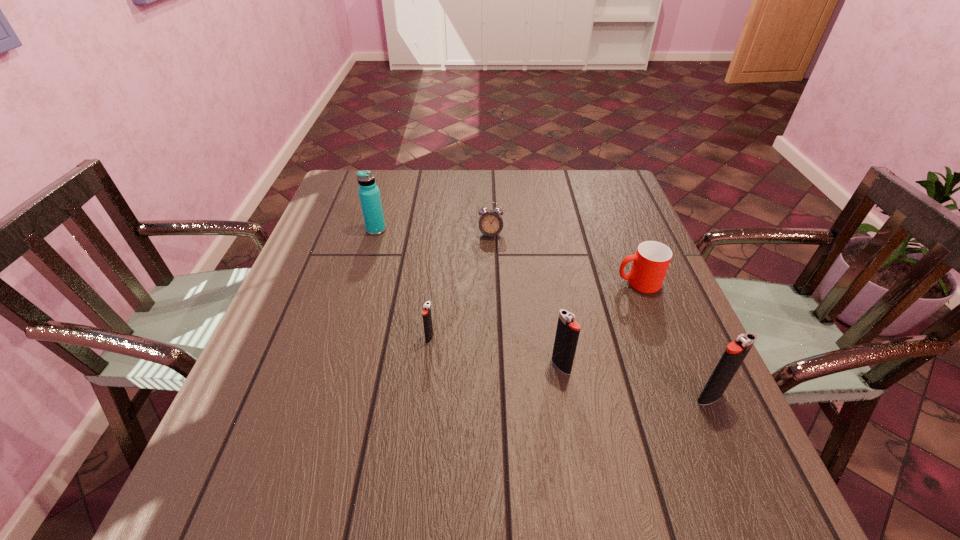
Find the location of a particular element. The image size is (960, 540). the fifth object from right to left is located at coordinates (426, 312).

Where is `the farthest igniter`? the farthest igniter is located at coordinates (426, 312).

Find the location of a particular element. The image size is (960, 540). the third object from right to left is located at coordinates 567,333.

At what (x,y) coordinates should I click in order to perform the action: click on the second shortest igniter. Please return your answer as a coordinate pair (x, y). Image resolution: width=960 pixels, height=540 pixels. Looking at the image, I should click on (567, 333).

This screenshot has height=540, width=960. I want to click on the nearest igniter, so click(x=736, y=351).

In order to click on the nearest object in this screenshot , I will do `click(736, 351)`.

The height and width of the screenshot is (540, 960). I want to click on alarm clock, so click(491, 224).

Locate an element on the screen. water bottle is located at coordinates (369, 193).

Image resolution: width=960 pixels, height=540 pixels. Find the location of `cup`. cup is located at coordinates (650, 262).

Identify the location of vacant space situated on the left of the fifth object from right to left. (389, 338).